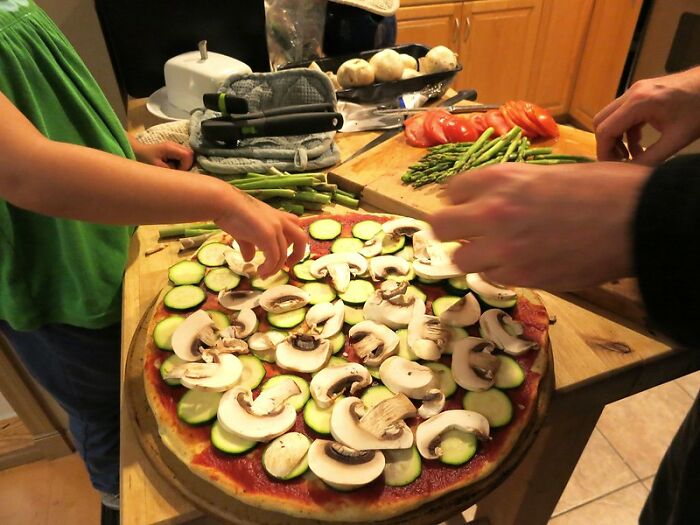
The height and width of the screenshot is (525, 700). What are the coordinates of `wooden floor` in the screenshot? It's located at (42, 480).